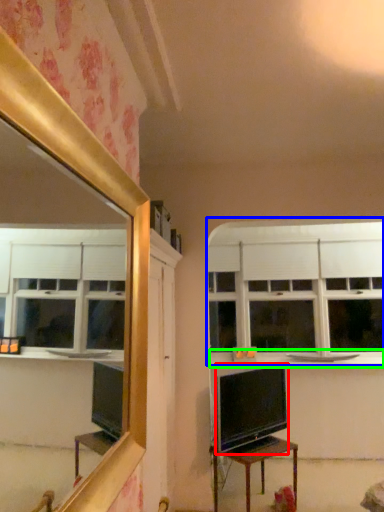
Question: Which object is positioned closest to television (highlighted by a red box)? Select from window (highlighted by a blue box) and counter top (highlighted by a green box).

Choices:
 (A) window
 (B) counter top

Answer: (B)